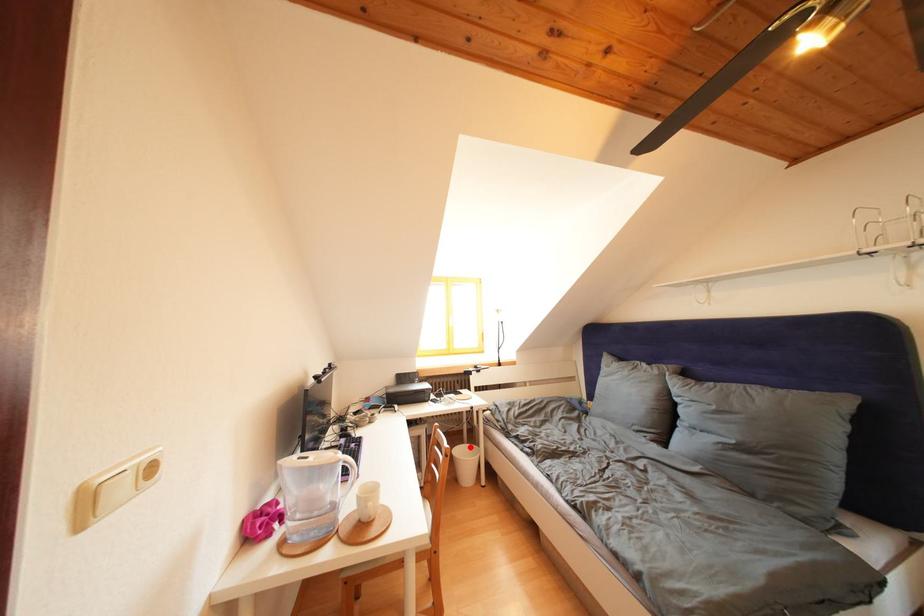
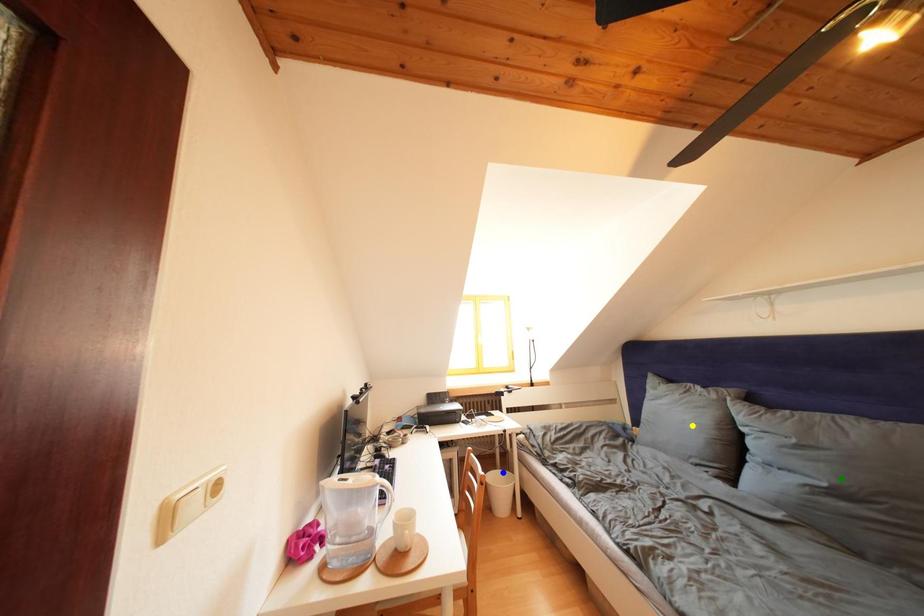
Question: I am providing you with two images of the same scene from different viewpoints. A red point is marked on the first image. You are given multiple points on the second image. Which mark in image 2 goes with the point in image 1?

Choices:
 (A) yellow point
 (B) green point
 (C) blue point

Answer: (C)